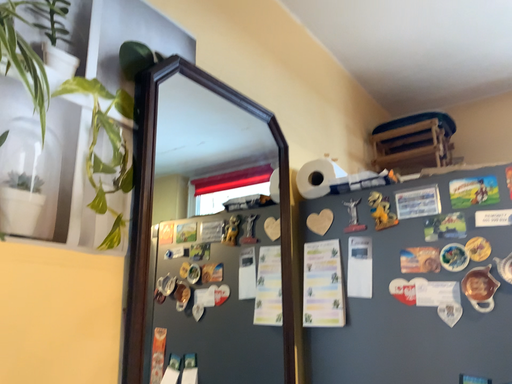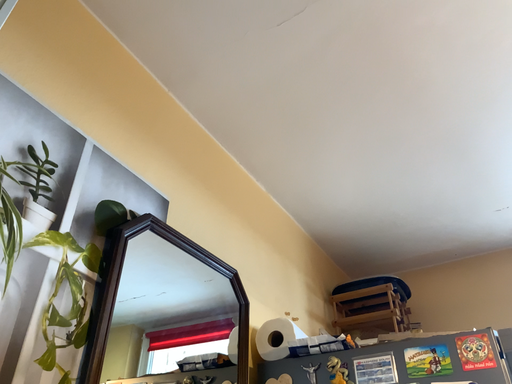
Question: Which way did the camera rotate in the video?

Choices:
 (A) rotated upward
 (B) rotated downward

Answer: (A)